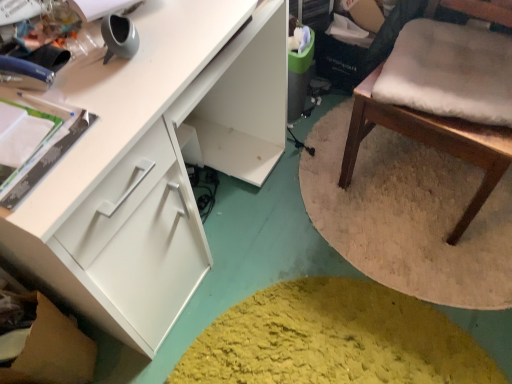
What are the coordinates of `vacant area to the left of wooden chair with white cushion at right` in the screenshot? It's located at (322, 194).